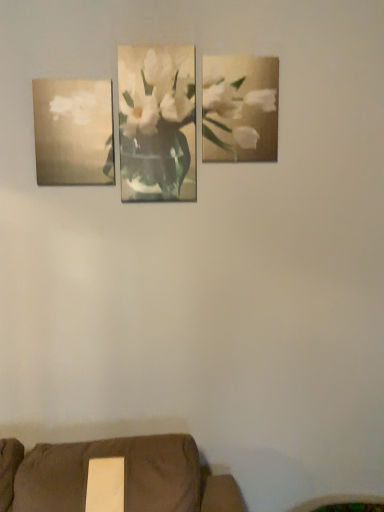
Question: Could you tell me if white matte flower at center is facing matte gold painting at left, the 1th picture frame viewed from the left?

Choices:
 (A) yes
 (B) no

Answer: (B)

Question: From the image's perspective, does white matte flower at center appear lower than matte gold painting at left, the second picture frame when ordered from right to left?

Choices:
 (A) no
 (B) yes

Answer: (A)

Question: From a real-world perspective, is white matte flower at center on top of matte gold painting at left, the second picture frame when ordered from right to left?

Choices:
 (A) yes
 (B) no

Answer: (A)

Question: Can matte gold painting at left, the 1th picture frame viewed from the left, be found inside white matte flower at center?

Choices:
 (A) no
 (B) yes

Answer: (A)

Question: From the image's perspective, is white matte flower at center over matte gold painting at left, the second picture frame when ordered from right to left?

Choices:
 (A) no
 (B) yes

Answer: (B)

Question: Is white matte flower at center shorter than matte gold painting at left, the 1th picture frame viewed from the left?

Choices:
 (A) no
 (B) yes

Answer: (A)

Question: Is metallic gold painting at upper right, the first picture frame from the right, looking in the opposite direction of white matte flower at center?

Choices:
 (A) no
 (B) yes

Answer: (A)

Question: Is metallic gold painting at upper right, the first picture frame from the right, facing towards white matte flower at center?

Choices:
 (A) yes
 (B) no

Answer: (B)

Question: Does metallic gold painting at upper right, the first picture frame from the right, appear on the left side of white matte flower at center?

Choices:
 (A) no
 (B) yes

Answer: (A)

Question: From the image's perspective, is metallic gold painting at upper right, the 2th picture frame when ordered from left to right, under white matte flower at center?

Choices:
 (A) yes
 (B) no

Answer: (B)

Question: Is white matte flower at center located within metallic gold painting at upper right, the 2th picture frame when ordered from left to right?

Choices:
 (A) yes
 (B) no

Answer: (B)

Question: Considering the relative sizes of metallic gold painting at upper right, the 2th picture frame when ordered from left to right, and white matte flower at center in the image provided, is metallic gold painting at upper right, the 2th picture frame when ordered from left to right, wider than white matte flower at center?

Choices:
 (A) yes
 (B) no

Answer: (A)

Question: Can you confirm if matte gold painting at left, the 1th picture frame viewed from the left, is smaller than metallic gold painting at upper right, the 2th picture frame when ordered from left to right?

Choices:
 (A) no
 (B) yes

Answer: (A)